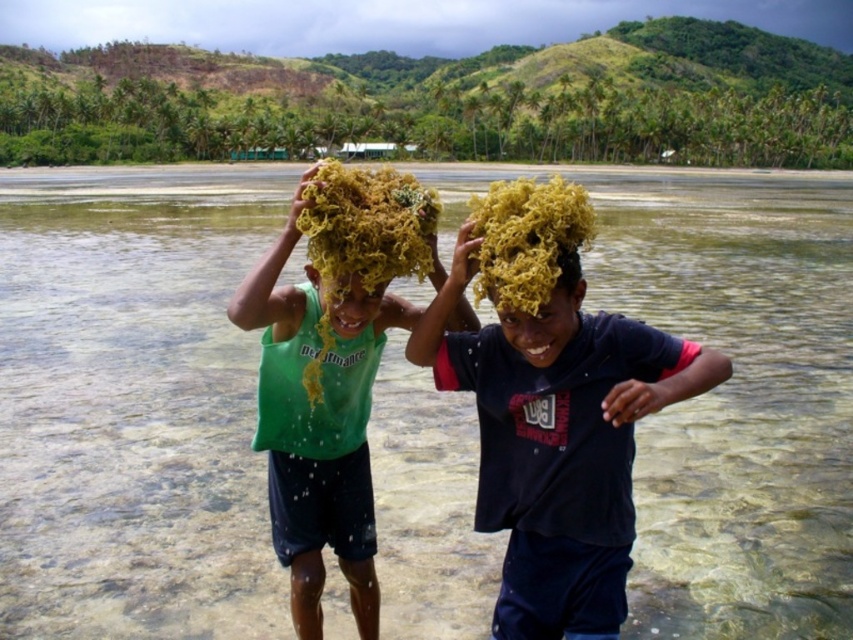
You are a photographer planning to take a photo of the clear water at center and the yellow curly hair at center. Which object should you focus on first if you want to capture both in a single shot without moving the camera?

The clear water at center is larger in size than the yellow curly hair at center, so you should focus on the clear water at center first to ensure it fits within the frame before adjusting for the smaller yellow curly hair at center.

You are standing at the beach and want to walk from point A to point B. Point A is located at coordinates point (833, 246) and point B is at point (251, 314). Which direction should you move to get closer to point B?

To move from point (833, 246) to point (251, 314), you should move downward and to the right because point (251, 314) is closer to the viewer and positioned to the right compared to point (833, 246).